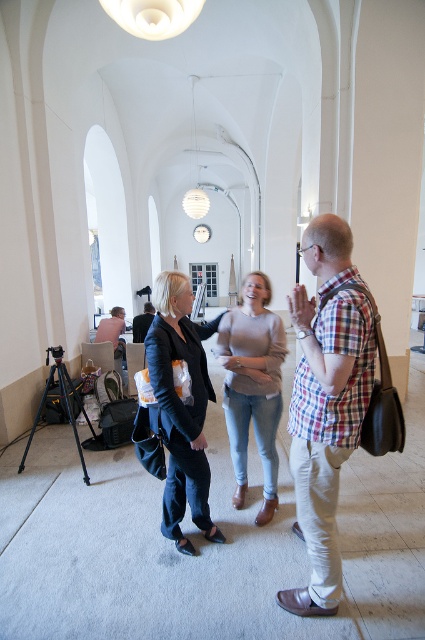
You are standing in the hallway and need to locate the dark blue fabric jacket at center. Where exactly is it positioned in the scene?

The dark blue fabric jacket at center is located at point (181,406) in the scene.

You are standing in the hallway and want to hand a document to the person wearing the plaid cotton shirt at center without disturbing the person in the dark blue fabric jacket at center. How can you approach?

The plaid cotton shirt at center is located above the dark blue fabric jacket at center, so you can approach from the side or behind the dark blue fabric jacket at center to reach the plaid cotton shirt at center without disturbing them.